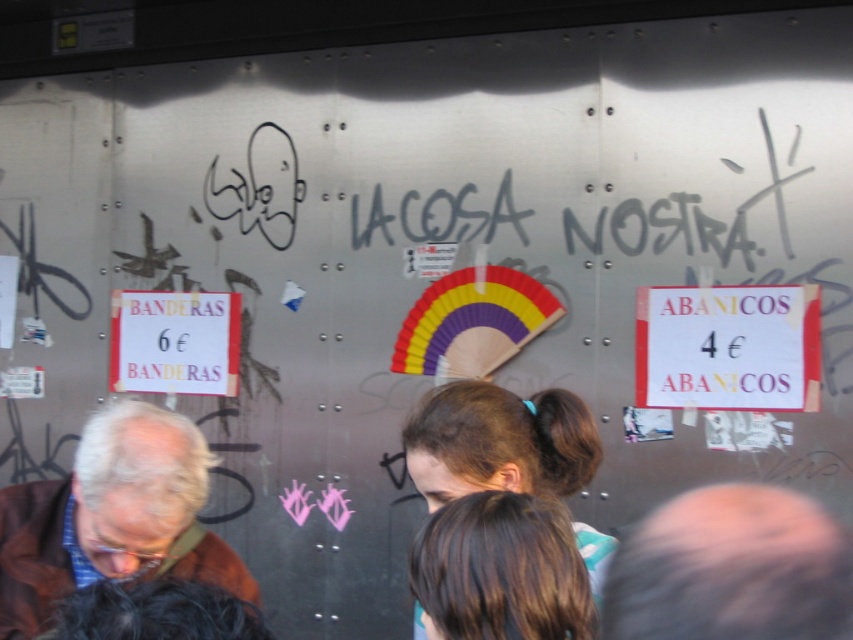
Looking at this image, is brown leather jacket at lower left to the right of brown hair at center from the viewer's perspective?

In fact, brown leather jacket at lower left is to the left of brown hair at center.

Is point (97, 493) closer to viewer compared to point (553, 452)?

Yes, it is.

Is point (4, 499) in front of point (531, 426)?

No, it is not.

What are the coordinates of `brown leather jacket at lower left` in the screenshot? It's located at (112, 516).

Is smooth skin head at lower right below white paper sign at left?

Yes.

Is smooth skin head at lower right thinner than white paper sign at left?

Correct, smooth skin head at lower right's width is less than white paper sign at left's.

Is point (711, 545) farther from camera compared to point (228, 323)?

That is False.

Where is `smooth skin head at lower right`? smooth skin head at lower right is located at coordinates (730, 568).

Is brown leather jacket at lower left above white paper sign at left?

No.

Who is positioned more to the right, brown leather jacket at lower left or white paper sign at left?

brown leather jacket at lower left

Who is more forward, (x=137, y=502) or (x=138, y=387)?

Point (x=137, y=502)

Where is `brown leather jacket at lower left`? The width and height of the screenshot is (853, 640). brown leather jacket at lower left is located at coordinates (112, 516).